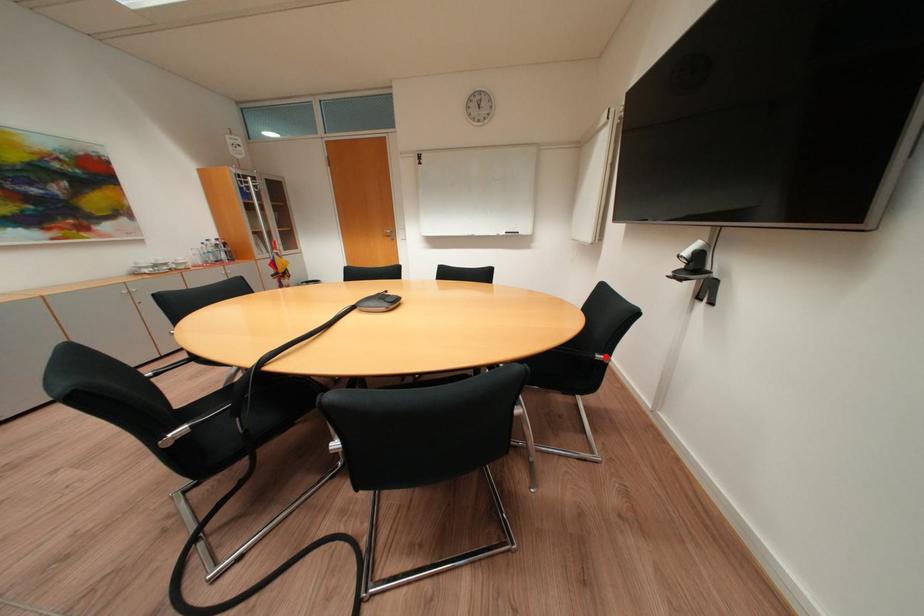
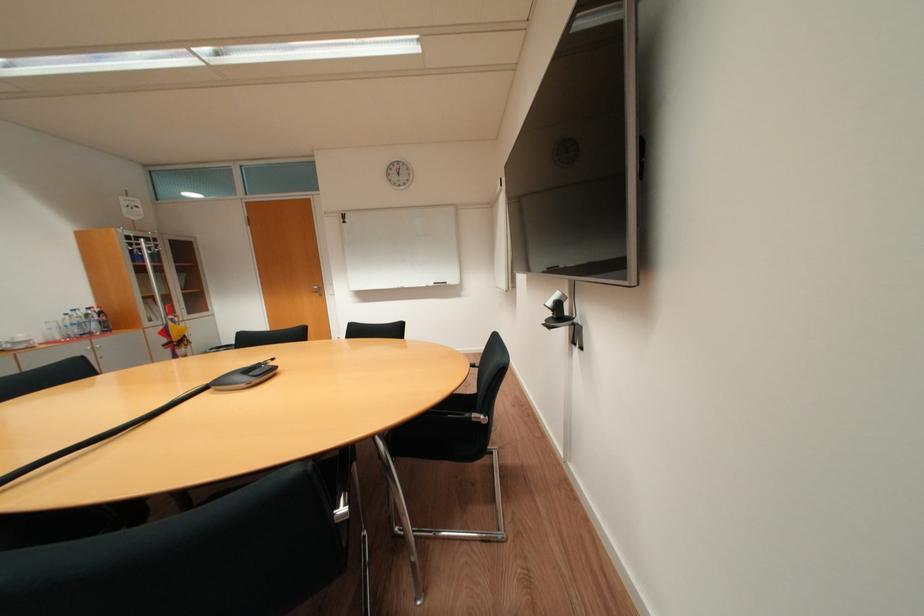
Locate, in the second image, the point that corresponds to the highlighted location in the first image.

(483, 416)